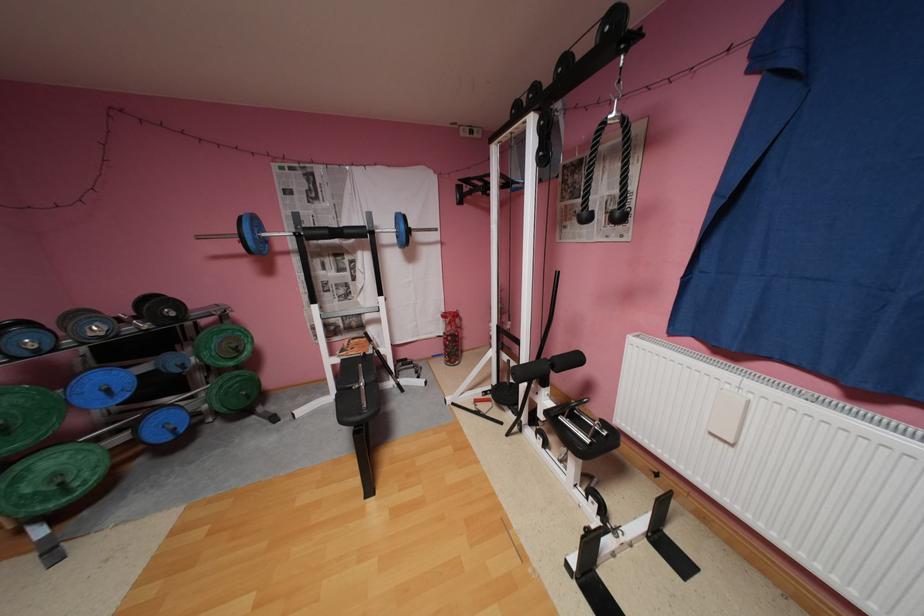
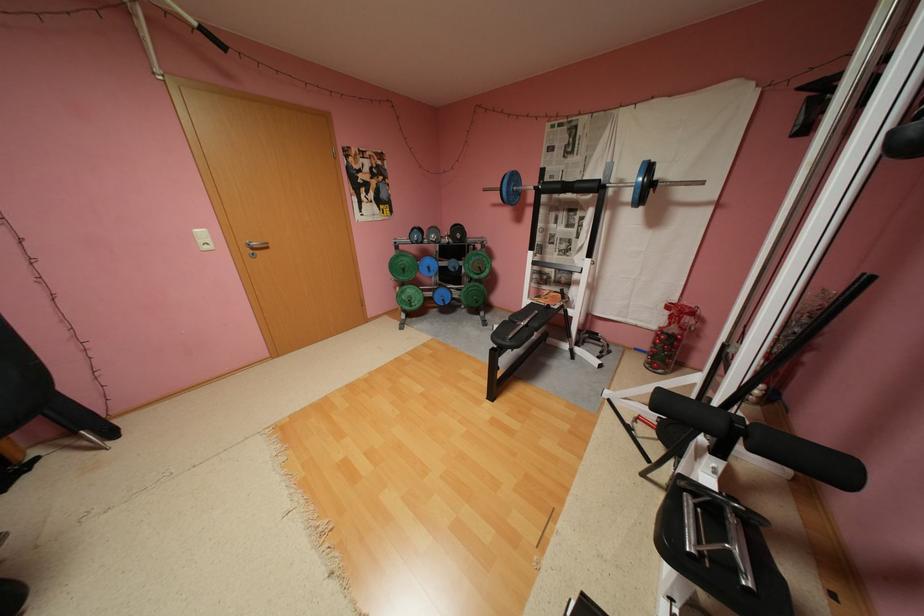
Find the pixel in the second image that matches (x=211, y=422) in the first image.

(468, 306)